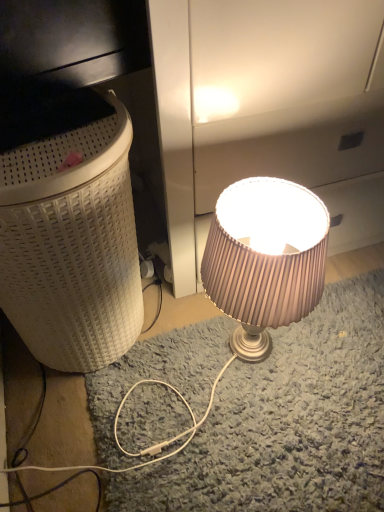
Based on the photo, in order to face white woven laundry basket at left, should I rotate leftwards or rightwards?

To align with it, rotate left about 16.872°.

Identify the location of white woven laundry basket at left. The image size is (384, 512). (69, 229).

What do you see at coordinates (69, 229) in the screenshot?
I see `white woven laundry basket at left` at bounding box center [69, 229].

At what (x,y) coordinates should I click in order to perform the action: click on white woven laundry basket at left. Please return your answer as a coordinate pair (x, y). The height and width of the screenshot is (512, 384). Looking at the image, I should click on (69, 229).